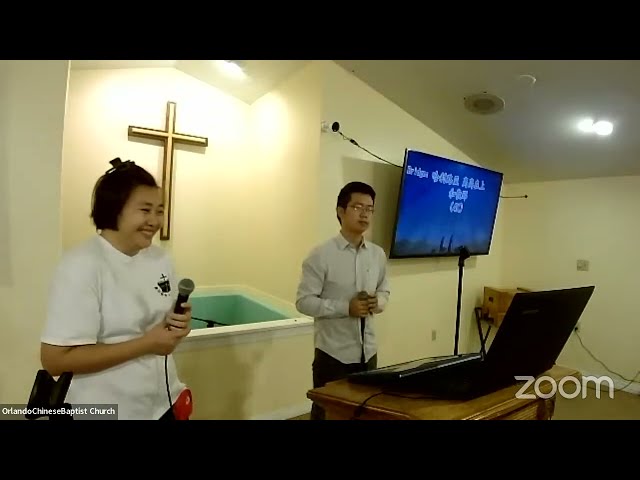
You are a GUI agent. You are given a task and a screenshot of the screen. Output one action in this format:
    pyautogui.click(x=<x>, y=<y>)
    Task: Click on the table
    The height and width of the screenshot is (480, 640).
    Given the screenshot: What is the action you would take?
    pyautogui.click(x=445, y=411)